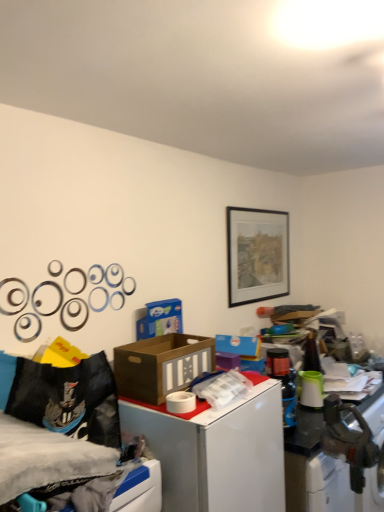
Question: Can you confirm if brown cardboard box at center is smaller than white cardboard box at upper right?

Choices:
 (A) no
 (B) yes

Answer: (B)

Question: Can you confirm if brown cardboard box at center is taller than white cardboard box at upper right?

Choices:
 (A) no
 (B) yes

Answer: (A)

Question: Is brown cardboard box at center aimed at white cardboard box at upper right?

Choices:
 (A) no
 (B) yes

Answer: (A)

Question: Considering the relative positions of brown cardboard box at center and white cardboard box at upper right in the image provided, is brown cardboard box at center to the left of white cardboard box at upper right from the viewer's perspective?

Choices:
 (A) yes
 (B) no

Answer: (A)

Question: Is brown cardboard box at center positioned with its back to white cardboard box at upper right?

Choices:
 (A) yes
 (B) no

Answer: (B)

Question: From a real-world perspective, does brown cardboard box at center stand above white cardboard box at upper right?

Choices:
 (A) yes
 (B) no

Answer: (A)

Question: Does metallic silver washing machine at lower right come in front of brown cardboard box at center?

Choices:
 (A) yes
 (B) no

Answer: (B)

Question: From the image's perspective, is metallic silver washing machine at lower right beneath brown cardboard box at center?

Choices:
 (A) yes
 (B) no

Answer: (A)

Question: Is metallic silver washing machine at lower right positioned with its back to brown cardboard box at center?

Choices:
 (A) yes
 (B) no

Answer: (B)

Question: Does metallic silver washing machine at lower right have a larger size compared to brown cardboard box at center?

Choices:
 (A) yes
 (B) no

Answer: (A)

Question: From a real-world perspective, is metallic silver washing machine at lower right located higher than brown cardboard box at center?

Choices:
 (A) no
 (B) yes

Answer: (A)

Question: Is metallic silver washing machine at lower right to the left of brown cardboard box at center from the viewer's perspective?

Choices:
 (A) yes
 (B) no

Answer: (B)

Question: Can you confirm if black matte picture frame at upper center is thinner than metallic silver washing machine at lower right?

Choices:
 (A) yes
 (B) no

Answer: (A)